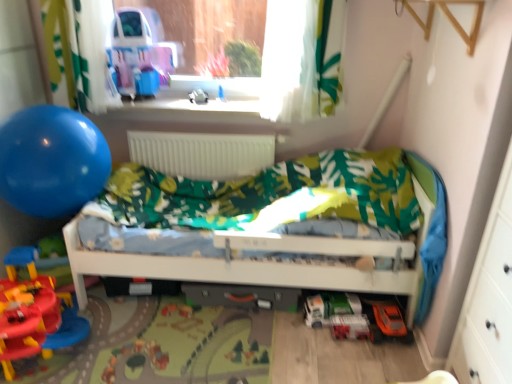
Question: Is green matte toy car at lower center, the 4th toy in the front-to-back sequence, positioned beyond the bounds of rubberized plastic playset at lower left, which appears as the fourth toy when ordered from the bottom?

Choices:
 (A) yes
 (B) no

Answer: (A)

Question: From a real-world perspective, is green matte toy car at lower center, the 3th toy ordered from the bottom, positioned under rubberized plastic playset at lower left, the second toy when ordered from top to bottom, based on gravity?

Choices:
 (A) yes
 (B) no

Answer: (A)

Question: Does green matte toy car at lower center, which is the third toy in right-to-left order, appear on the left side of rubberized plastic playset at lower left, positioned as the fifth toy in back-to-front order?

Choices:
 (A) no
 (B) yes

Answer: (A)

Question: Is green matte toy car at lower center, which is the third toy in right-to-left order, aimed at rubberized plastic playset at lower left, marked as the first toy in a left-to-right arrangement?

Choices:
 (A) yes
 (B) no

Answer: (A)

Question: Is the position of green matte toy car at lower center, marked as the 3th toy in a top-to-bottom arrangement, less distant than that of rubberized plastic playset at lower left, the second toy when ordered from top to bottom?

Choices:
 (A) yes
 (B) no

Answer: (B)

Question: From a real-world perspective, is green matte toy car at lower center, which is the third toy in right-to-left order, above or below shiny plastic toy car at upper left?

Choices:
 (A) above
 (B) below

Answer: (B)

Question: Would you say green matte toy car at lower center, which is counted as the 2th toy, starting from the back, is inside or outside shiny plastic toy car at upper left?

Choices:
 (A) outside
 (B) inside

Answer: (A)

Question: In the image, is green matte toy car at lower center, which is counted as the 3th toy, starting from the left, on the left side or the right side of shiny plastic toy car at upper left?

Choices:
 (A) left
 (B) right

Answer: (B)

Question: Is point (323, 321) positioned closer to the camera than point (135, 16)?

Choices:
 (A) farther
 (B) closer

Answer: (B)

Question: Looking at their shapes, would you say white matte radiator at center is wider or thinner than translucent plastic toy car at lower right, which ranks as the 1th toy in bottom-to-top order?

Choices:
 (A) thin
 (B) wide

Answer: (A)

Question: From a real-world perspective, is white matte radiator at center physically located above or below translucent plastic toy car at lower right, which ranks as the 1th toy in bottom-to-top order?

Choices:
 (A) below
 (B) above

Answer: (B)

Question: In the image, is white matte radiator at center on the left side or the right side of translucent plastic toy car at lower right, arranged as the 2th toy when viewed from the right?

Choices:
 (A) right
 (B) left

Answer: (B)

Question: Is white matte radiator at center bigger or smaller than translucent plastic toy car at lower right, which ranks as the 1th toy in bottom-to-top order?

Choices:
 (A) big
 (B) small

Answer: (A)

Question: Considering the positions of blue rubber balloon at left and orange matte toy car at lower right, the 4th toy viewed from the back, in the image, is blue rubber balloon at left bigger or smaller than orange matte toy car at lower right, the 4th toy viewed from the back,?

Choices:
 (A) big
 (B) small

Answer: (A)

Question: Does point (57, 195) appear closer or farther from the camera than point (389, 319)?

Choices:
 (A) closer
 (B) farther

Answer: (B)